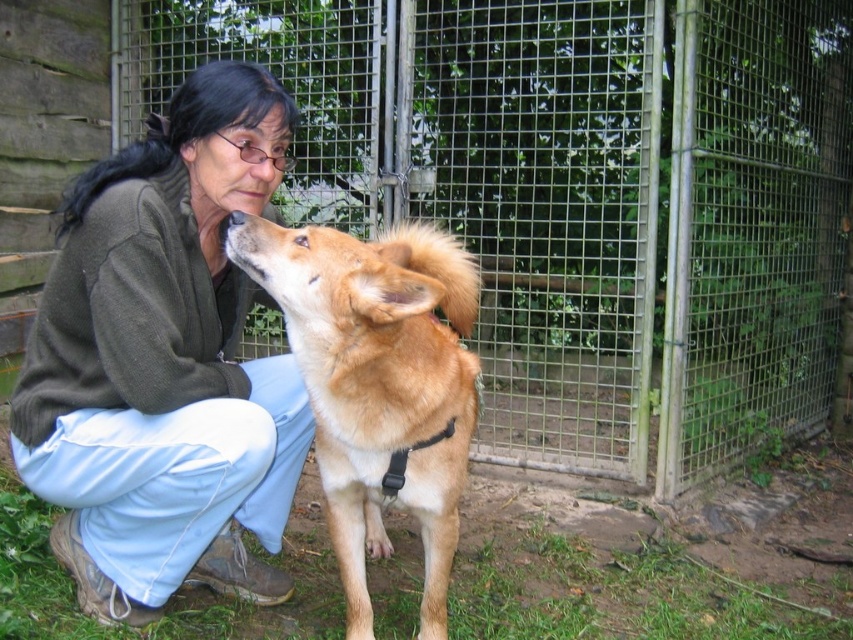
Question: Estimate the real-world distances between objects in this image. Which object is closer to the green wire mesh fence at center?

Choices:
 (A) fuzzy brown dog at center
 (B) matte green sweater at center

Answer: (A)

Question: Which of the following is the closest to the observer?

Choices:
 (A) fuzzy brown dog at center
 (B) green wire mesh fence at center

Answer: (A)

Question: Which point is farther from the camera taking this photo?

Choices:
 (A) (129, 221)
 (B) (407, 316)

Answer: (A)

Question: Can you confirm if green wire mesh fence at center is wider than fuzzy brown dog at center?

Choices:
 (A) no
 (B) yes

Answer: (B)

Question: Can you confirm if matte green sweater at center is positioned below fuzzy brown dog at center?

Choices:
 (A) no
 (B) yes

Answer: (A)

Question: From the image, what is the correct spatial relationship of matte green sweater at center in relation to fuzzy brown dog at center?

Choices:
 (A) right
 (B) left

Answer: (B)